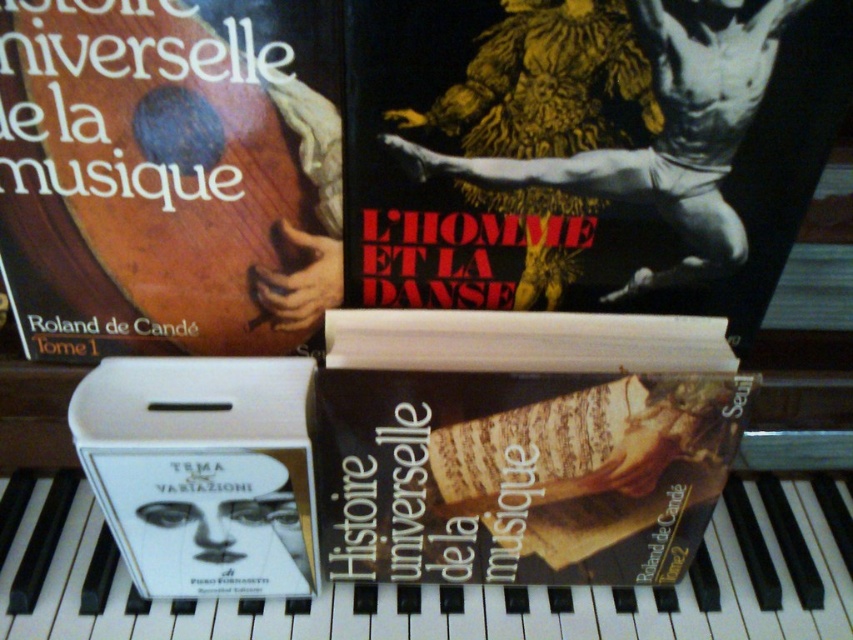
Question: Estimate the real-world distances between objects in this image. Which object is farther from the brown paperback book at center?

Choices:
 (A) white cardboard case at center
 (B) white glossy piano keys at lower center
 (C) wooden cover book at upper left

Answer: (C)

Question: Does brown paperback book at center appear on the right side of white glossy piano keys at lower center?

Choices:
 (A) yes
 (B) no

Answer: (A)

Question: Does wooden cover book at upper left have a greater width compared to white cardboard case at center?

Choices:
 (A) yes
 (B) no

Answer: (A)

Question: Which point is farther to the camera?

Choices:
 (A) (296, 540)
 (B) (187, 224)
 (C) (546, 593)

Answer: (C)

Question: Does wooden cover book at upper left appear on the right side of white cardboard case at center?

Choices:
 (A) no
 (B) yes

Answer: (A)

Question: Considering the real-world distances, which object is closest to the white cardboard case at center?

Choices:
 (A) brown paperback book at center
 (B) wooden cover book at upper left
 (C) white glossy piano keys at lower center

Answer: (A)